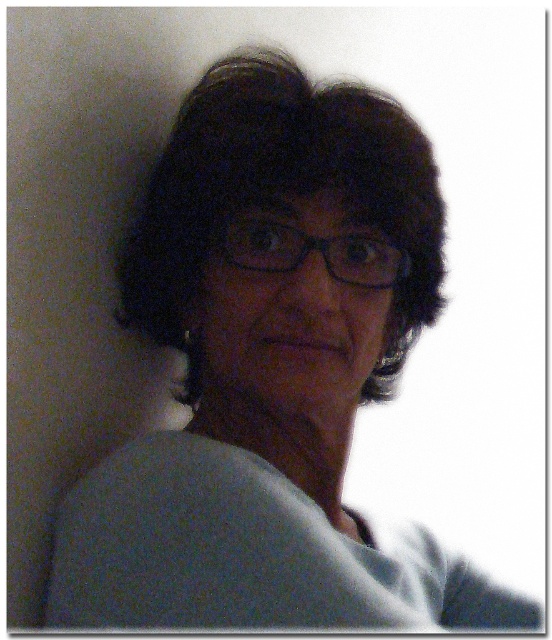
Can you confirm if dark curly hair at center is shorter than black plastic glasses at center?

No, dark curly hair at center is not shorter than black plastic glasses at center.

Find the location of a particular element. dark curly hair at center is located at coordinates (282, 196).

This screenshot has width=552, height=640. What do you see at coordinates (282, 196) in the screenshot? I see `dark curly hair at center` at bounding box center [282, 196].

Find the location of `dark curly hair at center`. dark curly hair at center is located at coordinates (282, 196).